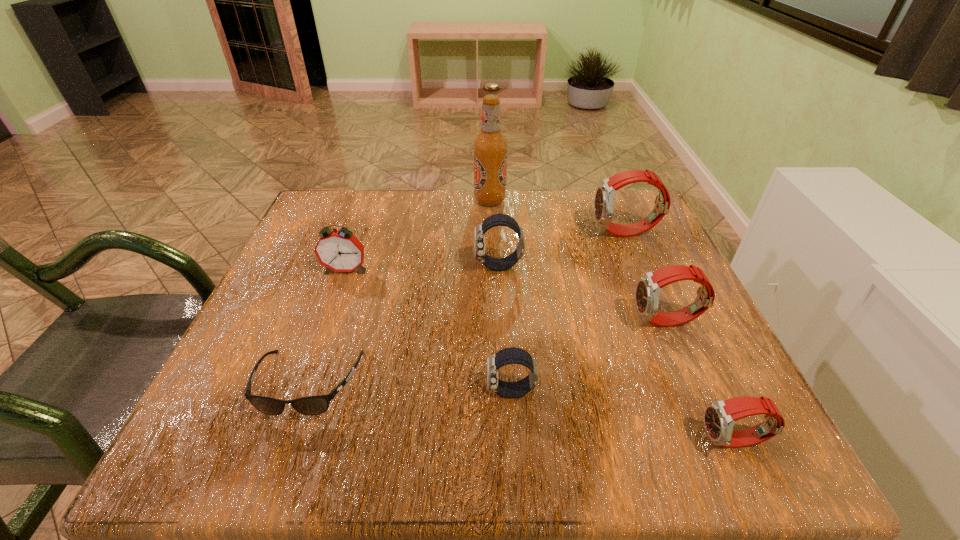
The height and width of the screenshot is (540, 960). Find the location of `object located at the near left corner`. object located at the near left corner is located at coordinates (312, 405).

Where is `object that is positioned at the far right corner`? This screenshot has width=960, height=540. object that is positioned at the far right corner is located at coordinates (605, 194).

At what (x,y) coordinates should I click in order to perform the action: click on object present at the near right corner. Please return your answer as a coordinate pair (x, y). Looking at the image, I should click on point(720,416).

Identify the location of free space at the far edge of the desktop. The width and height of the screenshot is (960, 540). (528, 205).

I want to click on vacant space at the near edge of the desktop, so click(x=661, y=451).

Identify the location of vacant space at the left edge of the desktop. (280, 356).

Image resolution: width=960 pixels, height=540 pixels. In order to click on vacant region at the right edge of the desktop in this screenshot , I will do `click(675, 303)`.

You are a GUI agent. You are given a task and a screenshot of the screen. Output one action in this format:
    pyautogui.click(x=<x>, y=<y>)
    Task: Click on the blank area at the far left corner
    The height and width of the screenshot is (540, 960).
    Given the screenshot: What is the action you would take?
    pyautogui.click(x=359, y=219)

In order to click on vacant position at the far right corner of the desktop in this screenshot , I will do `click(632, 244)`.

The width and height of the screenshot is (960, 540). In order to click on unoccupied area between the smaller dark watch and the tallest object in this screenshot , I will do `click(500, 296)`.